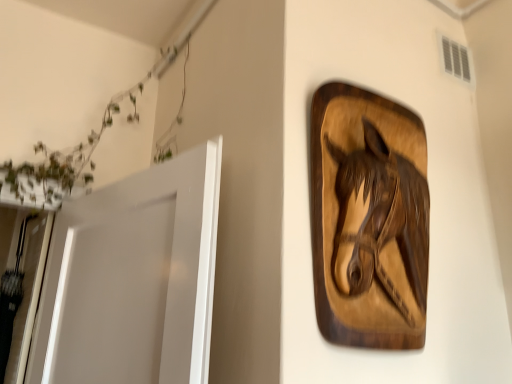
The height and width of the screenshot is (384, 512). What do you see at coordinates (79, 153) in the screenshot?
I see `green leafy plant at upper left` at bounding box center [79, 153].

Measure the distance between green leafy plant at upper left and camera.

green leafy plant at upper left and camera are 1.50 meters apart from each other.

The width and height of the screenshot is (512, 384). What are the coordinates of `green leafy plant at upper left` in the screenshot? It's located at (79, 153).

At what (x,y) coordinates should I click in order to perform the action: click on green leafy plant at upper left. Please return your answer as a coordinate pair (x, y). This screenshot has height=384, width=512. Looking at the image, I should click on (79, 153).